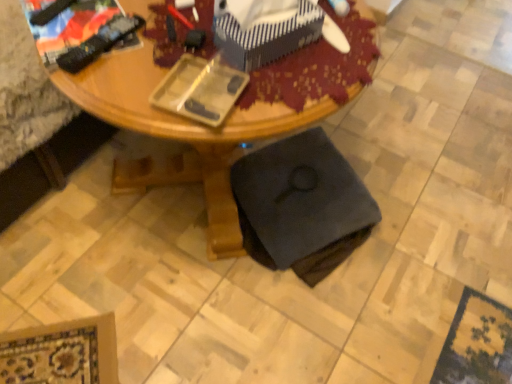
You are a GUI agent. You are given a task and a screenshot of the screen. Output one action in this format:
    pyautogui.click(x=<x>, y=<y>)
    Task: Click on the vacant space to the left of blue striped fabric box at upper center
    The width and height of the screenshot is (512, 384).
    Given the screenshot: What is the action you would take?
    pyautogui.click(x=176, y=51)